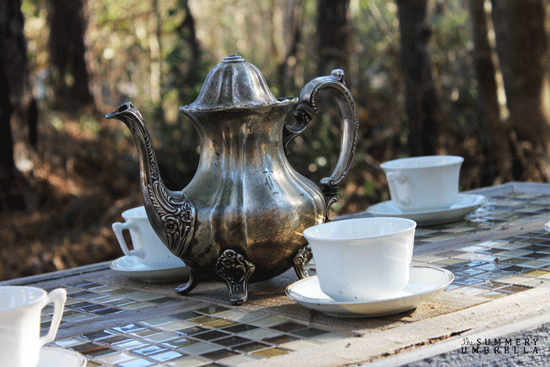
Identify the location of cup. This screenshot has height=367, width=550. (415, 179).